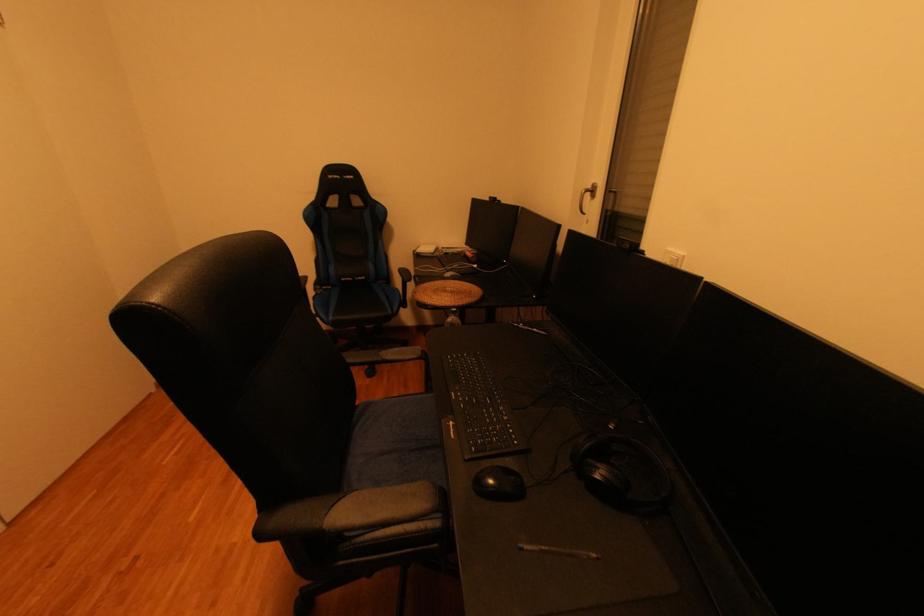
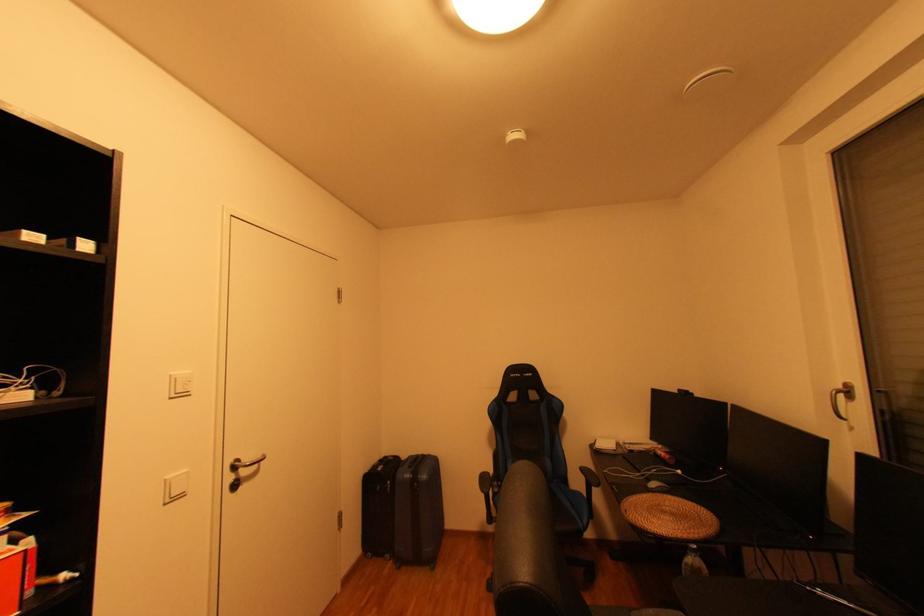
Locate, in the second image, the point that corresponds to point (456, 292) in the first image.

(674, 513)